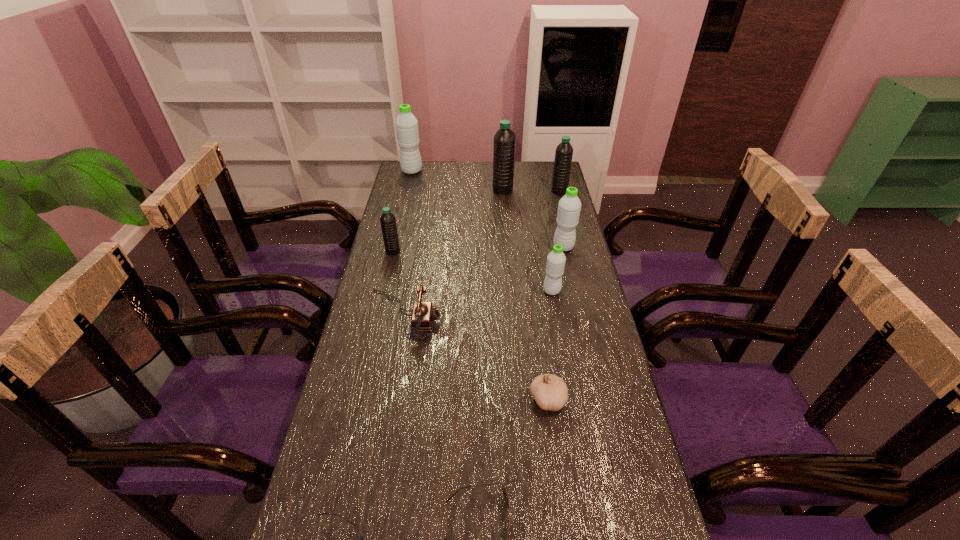
Image resolution: width=960 pixels, height=540 pixels. In order to click on the second green water bottle from right to left in this screenshot , I will do point(555,265).

Where is `telephone`? The image size is (960, 540). telephone is located at coordinates (423, 314).

The height and width of the screenshot is (540, 960). I want to click on garlic, so click(x=550, y=392).

Where is `the third nearest object`? the third nearest object is located at coordinates (550, 392).

Where is `free region located on the front of the farthest green water bottle`? The image size is (960, 540). free region located on the front of the farthest green water bottle is located at coordinates (409, 184).

Identify the location of free region located on the left of the third water bottle from left to right. (411, 190).

Find the location of `free region located 0.340m on the front of the rightmost black water bottle`. free region located 0.340m on the front of the rightmost black water bottle is located at coordinates (573, 245).

Locate an element on the screen. free space located on the left of the rightmost green water bottle is located at coordinates [x=475, y=247].

At what (x,y) coordinates should I click in order to perform the action: click on blank space located 0.220m on the front of the leftmost black water bottle. Please return your answer as a coordinate pair (x, y). Looking at the image, I should click on (381, 300).

You are a GUI agent. You are given a task and a screenshot of the screen. Output one action in this format:
    pyautogui.click(x=<x>, y=<y>)
    Task: Click on the vacant space situated 0.270m on the back of the nearest green water bottle
    
    Given the screenshot: What is the action you would take?
    pyautogui.click(x=542, y=235)